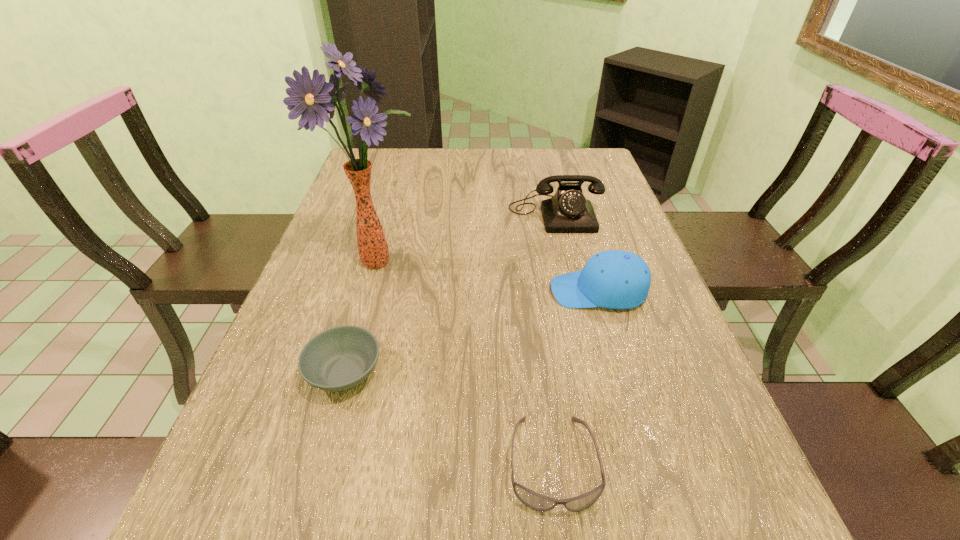
Identify the location of flower arrangement. (314, 99).

The height and width of the screenshot is (540, 960). Find the location of `the farthest object`. the farthest object is located at coordinates (568, 211).

This screenshot has width=960, height=540. Find the location of `cap`. cap is located at coordinates 613,279.

This screenshot has height=540, width=960. I want to click on soup bowl, so click(339, 358).

Where is `sunglasses`? sunglasses is located at coordinates pos(533,500).

The width and height of the screenshot is (960, 540). Identify the location of vacant position located on the back of the tallest object. (391, 216).

Where is `vacant space located on the front face of the telephone`? Image resolution: width=960 pixels, height=540 pixels. vacant space located on the front face of the telephone is located at coordinates (576, 300).

The width and height of the screenshot is (960, 540). Identify the location of free location located on the front-facing side of the cap. (503, 291).

Identify the location of free region located on the front-facing side of the cap. (508, 291).

Where is `vacant area situated 0.250m on the front-facing side of the cap`? The image size is (960, 540). vacant area situated 0.250m on the front-facing side of the cap is located at coordinates (444, 291).